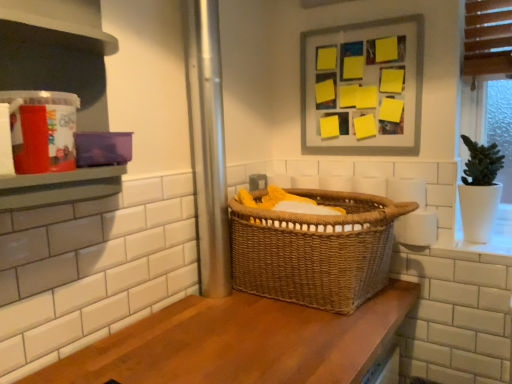
Identify the location of vacant region in front of woven brown basket at center. [x=282, y=345].